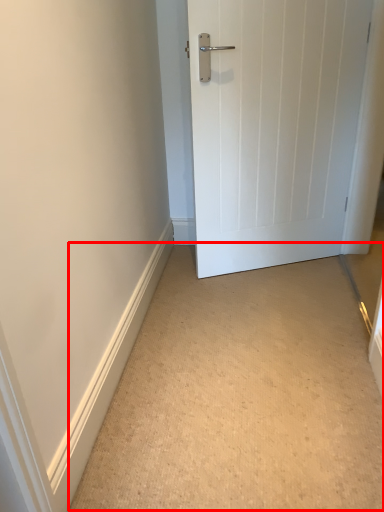
Question: From the image's perspective, what is the correct spatial positioning of corridor (annotated by the red box) in reference to door?

Choices:
 (A) above
 (B) below

Answer: (B)